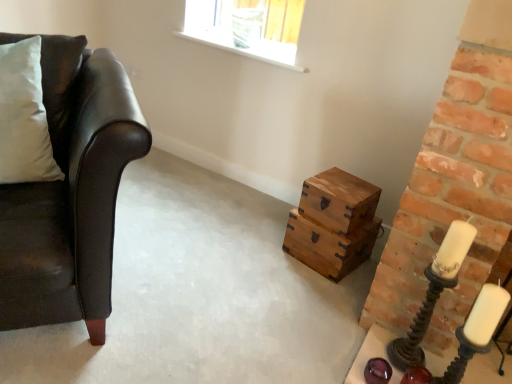
Question: From the image's perspective, is matte black leather couch at left located above or below matte black candle holder at right, the second candle holder from the left?

Choices:
 (A) below
 (B) above

Answer: (B)

Question: Considering the positions of matte black leather couch at left and matte black candle holder at right, the 1th candle holder in the right-to-left sequence, in the image, is matte black leather couch at left taller or shorter than matte black candle holder at right, the 1th candle holder in the right-to-left sequence,?

Choices:
 (A) tall
 (B) short

Answer: (A)

Question: Which object is positioned closest to the metallic spiral candle holder at right, the second candle holder in the right-to-left sequence?

Choices:
 (A) matte black candle holder at right, the 1th candle holder in the right-to-left sequence
 (B) matte black leather couch at left
 (C) wooden chest at center-right
 (D) white soft pillow at left
 (E) wooden box at center

Answer: (A)

Question: Which object is positioned farthest from the matte black leather couch at left?

Choices:
 (A) white wax candle at right
 (B) wooden box at center
 (C) metallic spiral candle holder at right, the second candle holder in the right-to-left sequence
 (D) white soft pillow at left
 (E) wooden chest at center-right

Answer: (A)